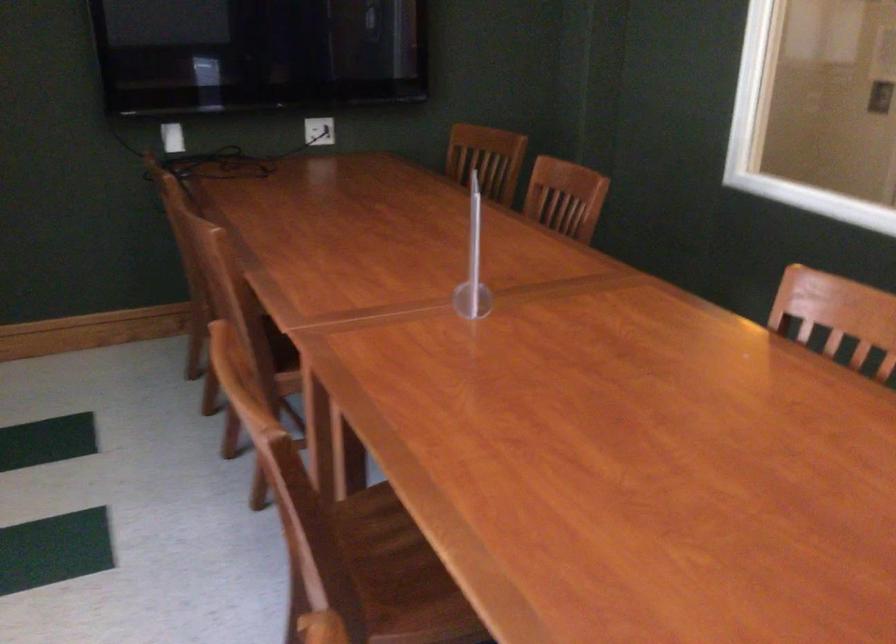
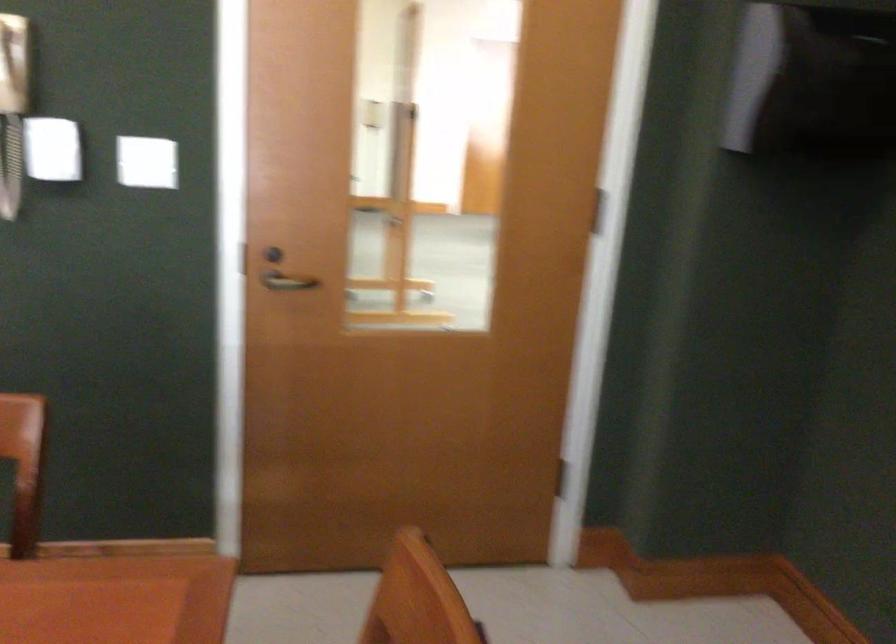
Question: The camera is either moving clockwise (left) or counter-clockwise (right) around the object. The first image is from the beginning of the video and the second image is from the end. Is the camera moving left or right when shooting the video?

Choices:
 (A) Left
 (B) Right

Answer: (A)